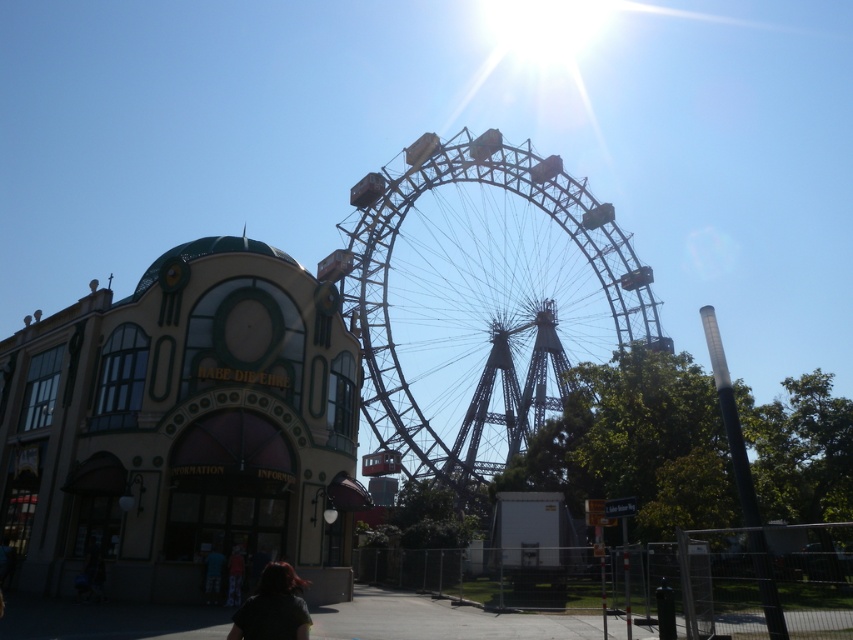
You are standing at the entrance of the building with the rounded arches and you want to take a photo of the metallic gray ferris wheel at center and the dark hair at lower center. Which object should you zoom in more on to capture both in the frame?

You should zoom in more on the dark hair at lower center because the metallic gray ferris wheel at center is larger in size compared to dark hair at lower center, so zooming in on the smaller object will help fit both in the frame.

You are standing at the dark hair at lower center and want to take a photo of the metallic gray ferris wheel at center. Which direction should you face to capture the Ferris wheel in your camera?

The metallic gray ferris wheel at center is positioned on the right side of dark hair at lower center, so you should face to the right to capture the Ferris wheel in your camera.